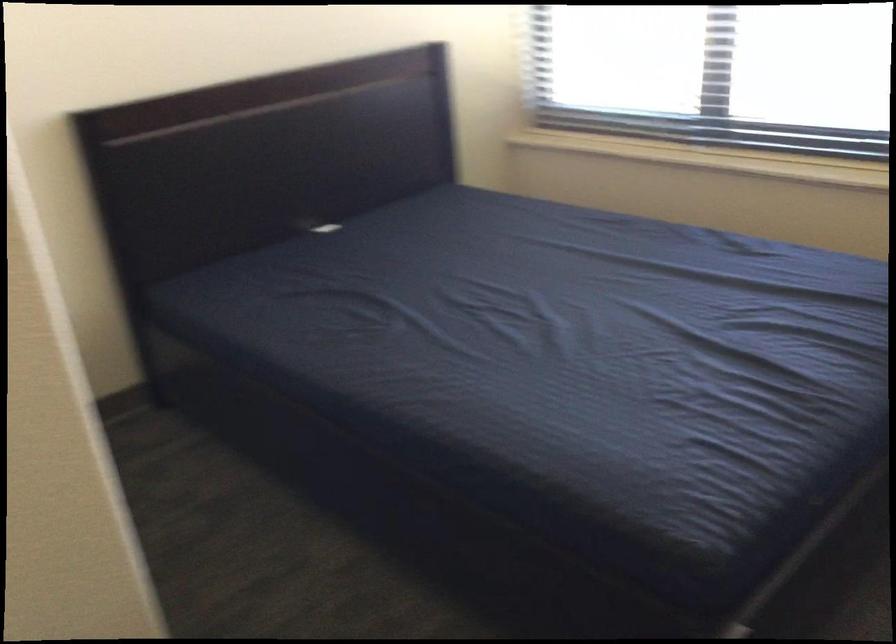
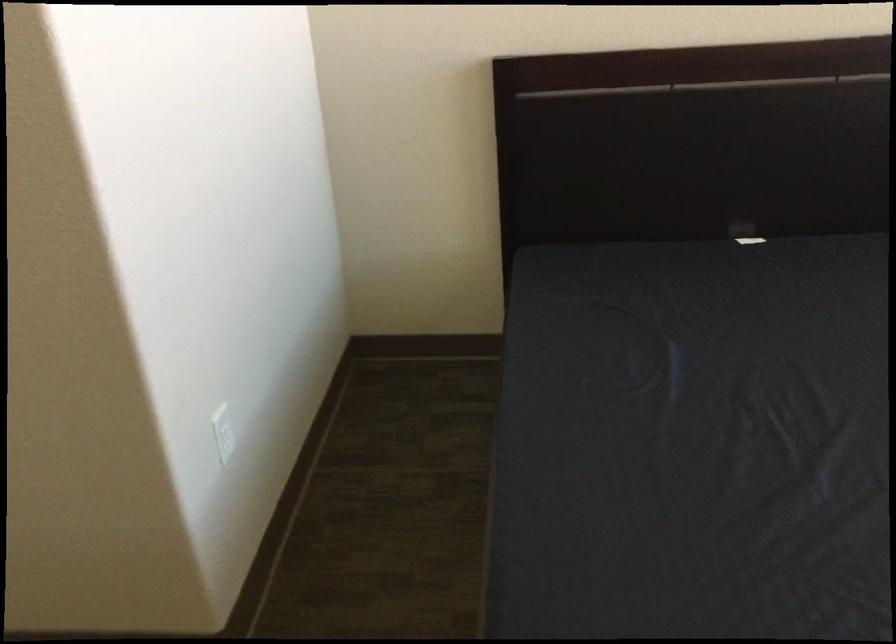
The point at (108, 506) is marked in the first image. Where is the corresponding point in the second image?

(222, 431)